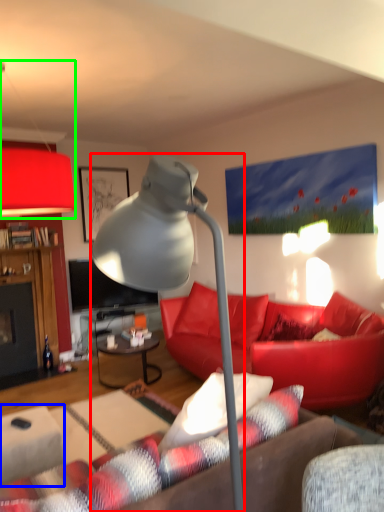
Question: Estimate the real-world distances between objects in this image. Which object is farther from lamp (highlighted by a red box), table (highlighted by a blue box) or lamp (highlighted by a green box)?

Choices:
 (A) table
 (B) lamp

Answer: (B)